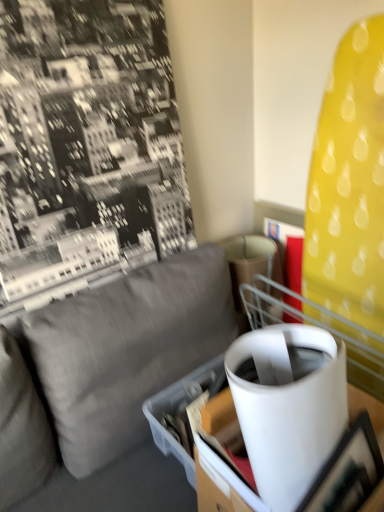
Question: Does cardboard box at center have a lesser height compared to matte black picture frame at lower right?

Choices:
 (A) no
 (B) yes

Answer: (B)

Question: Does cardboard box at center have a lesser width compared to matte black picture frame at lower right?

Choices:
 (A) no
 (B) yes

Answer: (A)

Question: From the image's perspective, would you say cardboard box at center is positioned over matte black picture frame at lower right?

Choices:
 (A) yes
 (B) no

Answer: (A)

Question: Can you confirm if cardboard box at center is taller than matte black picture frame at lower right?

Choices:
 (A) yes
 (B) no

Answer: (B)

Question: Is cardboard box at center facing towards matte black picture frame at lower right?

Choices:
 (A) no
 (B) yes

Answer: (A)

Question: Is cardboard box at center far away from matte black picture frame at lower right?

Choices:
 (A) no
 (B) yes

Answer: (A)

Question: Does cardboard box at center have a lesser height compared to gray fabric couch at center?

Choices:
 (A) yes
 (B) no

Answer: (A)

Question: From a real-world perspective, is cardboard box at center below gray fabric couch at center?

Choices:
 (A) no
 (B) yes

Answer: (A)

Question: Does cardboard box at center have a greater height compared to gray fabric couch at center?

Choices:
 (A) no
 (B) yes

Answer: (A)

Question: From a real-world perspective, is cardboard box at center positioned over gray fabric couch at center based on gravity?

Choices:
 (A) no
 (B) yes

Answer: (B)

Question: From the image's perspective, would you say cardboard box at center is positioned over gray fabric couch at center?

Choices:
 (A) no
 (B) yes

Answer: (B)

Question: Does cardboard box at center have a smaller size compared to gray fabric couch at center?

Choices:
 (A) no
 (B) yes

Answer: (B)

Question: Could white glossy table at center be considered to be inside matte black picture frame at lower right?

Choices:
 (A) yes
 (B) no

Answer: (A)